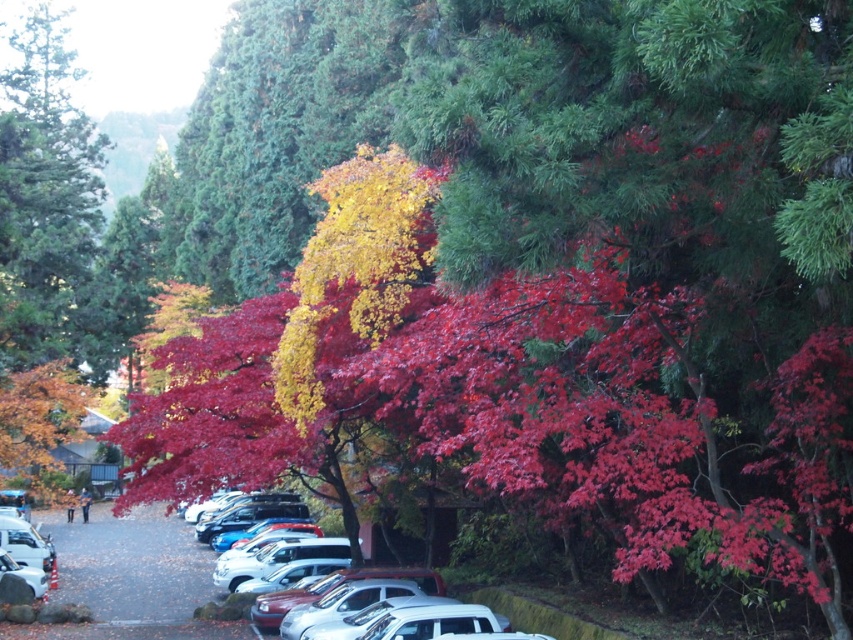
Between green matte tree at upper left and white glossy car at lower left, which one is positioned lower?

white glossy car at lower left is lower down.

Does point (27, 156) come in front of point (27, 522)?

No.

Between point (13, 273) and point (36, 550), which one is positioned in front?

Point (36, 550) is more forward.

Where is `green matte tree at upper left`? The height and width of the screenshot is (640, 853). green matte tree at upper left is located at coordinates (44, 195).

Which of these two, green matte tree at upper left or white matte car at center, stands taller?

green matte tree at upper left is taller.

In order to click on green matte tree at upper left in this screenshot , I will do `click(44, 195)`.

Which is behind, point (99, 157) or point (271, 593)?

The point (99, 157) is behind.

Identify the location of green matte tree at upper left. 44,195.

Can you confirm if white matte car at center is smaller than white glossy car at lower left?

Correct, white matte car at center occupies less space than white glossy car at lower left.

Where is `white matte car at center`? The height and width of the screenshot is (640, 853). white matte car at center is located at coordinates (326, 592).